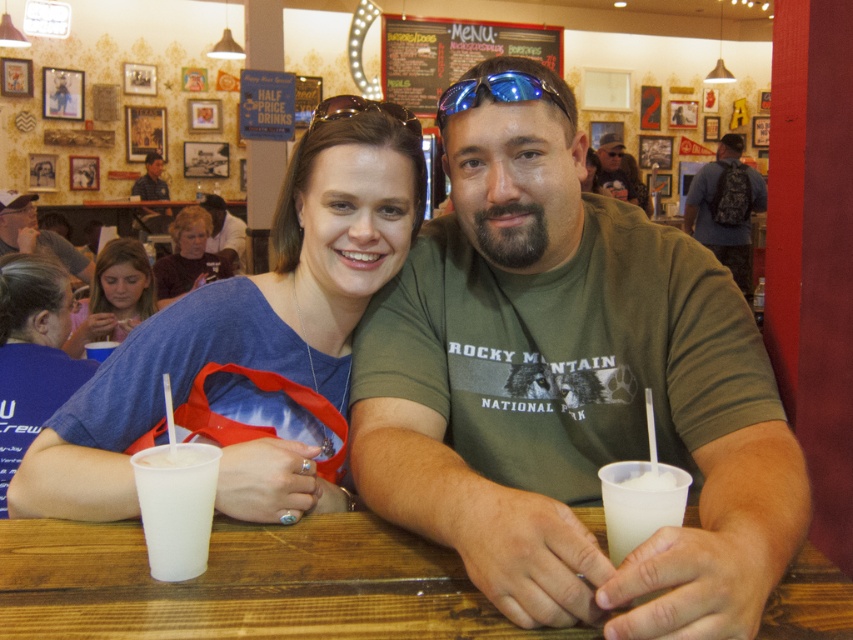
Between blue cotton shirt at center and chalkboard menu at upper center, which one is positioned higher?

Positioned higher is chalkboard menu at upper center.

Is point (64, 404) positioned after point (421, 104)?

No.

Locate an element on the screen. The image size is (853, 640). blue cotton shirt at center is located at coordinates (245, 316).

Which of these two, matte plastic cup at lower left or matte black shirt at upper center, stands shorter?

Standing shorter between the two is matte plastic cup at lower left.

Between matte plastic cup at lower left and matte black shirt at upper center, which one appears on the right side from the viewer's perspective?

Positioned to the right is matte plastic cup at lower left.

I want to click on matte plastic cup at lower left, so (x=114, y=296).

Does chalkboard menu at upper center appear on the left side of white frothy drink at lower center?

In fact, chalkboard menu at upper center is to the right of white frothy drink at lower center.

Who is more forward, (548, 35) or (651, 490)?

Positioned in front is point (651, 490).

Who is more forward, [521,26] or [612,506]?

Point [612,506]

You are a GUI agent. You are given a task and a screenshot of the screen. Output one action in this format:
    pyautogui.click(x=<x>, y=<y>)
    Task: Click on the chalkboard menu at upper center
    The height and width of the screenshot is (640, 853).
    Given the screenshot: What is the action you would take?
    (451, 52)